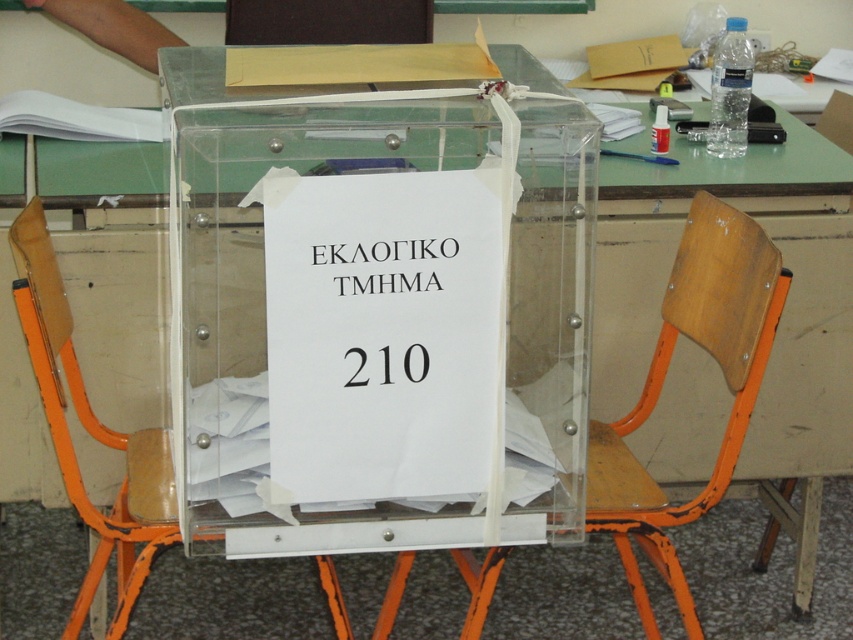
You are an election official trying to place a new ballot box on the table. The ballot box requires a stable base. Which object between the wooden at center and the orange plastic chair at center would provide a wider surface for the base?

The orange plastic chair at center is wider than the wooden at center, so it would provide a more stable base for the ballot box.

From the picture: You are standing in front of the ballot box on the table. There is a wooden object at point [663,378]. What is the object at that point?

The object at point [663,378] is wooden.

You are setting up an election booth and need to place both the orange plastic chair at center and the black paper sign at center on a table. Considering their sizes, which object should you place first to ensure stability?

The orange plastic chair at center is larger than the black paper sign at center, so you should place the orange plastic chair at center first to establish a stable base before placing the smaller sign.